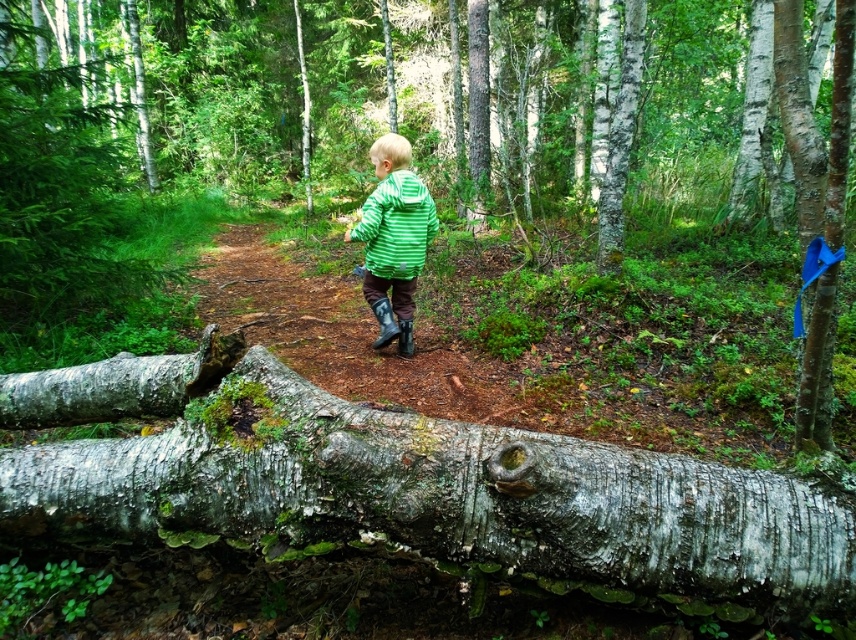
Does smooth bark log at lower center lie behind green striped jacket at center?

No, it is in front of green striped jacket at center.

Can you confirm if smooth bark log at lower center is thinner than green striped jacket at center?

No.

Find the location of a particular element. The image size is (856, 640). smooth bark log at lower center is located at coordinates (438, 202).

Measure the distance between smooth gray bark at center and camera.

smooth gray bark at center is 3.43 feet from camera.

Between point (411, 484) and point (421, 252), which one is positioned in front?

Positioned in front is point (411, 484).

Is point (521, 550) closer to camera compared to point (378, 224)?

Yes, point (521, 550) is in front of point (378, 224).

Identify the location of smooth gray bark at center. (409, 484).

Does point (514, 193) lie behind point (450, 522)?

That is True.

Is smooth bark log at lower center smaller than smooth gray bark at center?

No.

Find the location of `smooth bark log at lower center`. smooth bark log at lower center is located at coordinates (438, 202).